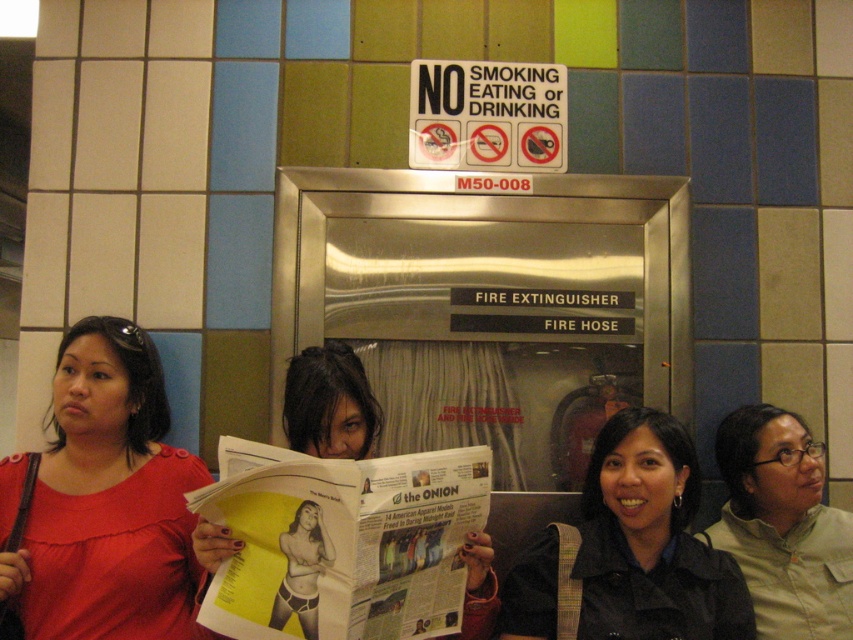
Does black matte jacket at lower right have a greater width compared to matte black hair at center?

Yes, black matte jacket at lower right is wider than matte black hair at center.

Who is more distant from viewer, (612, 536) or (479, 538)?

The point (612, 536) is more distant.

Which is in front, point (604, 497) or point (354, 429)?

Point (354, 429) is in front.

Locate an element on the screen. black matte jacket at lower right is located at coordinates (651, 540).

Is point (689, 483) more distant than point (728, 476)?

That is False.

Looking at this image, is black matte jacket at lower right thinner than matte khaki shirt at lower right?

Incorrect, black matte jacket at lower right's width is not less than matte khaki shirt at lower right's.

Based on the photo, who is more distant from viewer, (584, 556) or (798, 442)?

The point (798, 442) is behind.

At what (x,y) coordinates should I click in order to perform the action: click on black matte jacket at lower right. Please return your answer as a coordinate pair (x, y). Looking at the image, I should click on (651, 540).

Measure the distance between matte khaki shirt at lower right and camera.

matte khaki shirt at lower right is 5.81 feet away from camera.

Describe the element at coordinates (782, 525) in the screenshot. I see `matte khaki shirt at lower right` at that location.

Find the location of `matte khaki shirt at lower right`. matte khaki shirt at lower right is located at coordinates (782, 525).

Where is `matte khaki shirt at lower right`? matte khaki shirt at lower right is located at coordinates (782, 525).